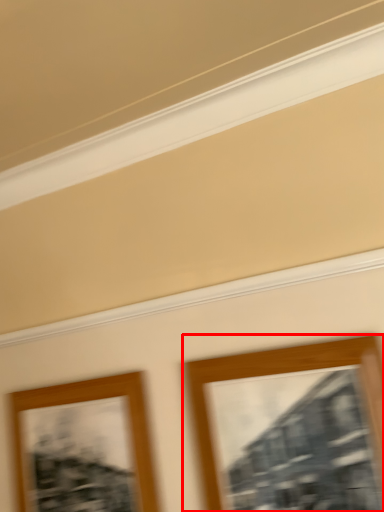
Question: From the image's perspective, where is picture frame (annotated by the red box) located in relation to picture frame in the image?

Choices:
 (A) below
 (B) above

Answer: (B)